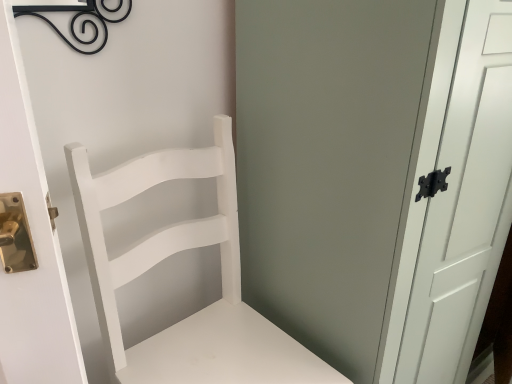
Question: From the image's perspective, is white matte screen door at center above or below white matte wood chair at center?

Choices:
 (A) below
 (B) above

Answer: (B)

Question: Is white matte screen door at center spatially inside white matte wood chair at center, or outside of it?

Choices:
 (A) inside
 (B) outside

Answer: (B)

Question: Considering the positions of white matte screen door at center and white matte wood chair at center in the image, is white matte screen door at center taller or shorter than white matte wood chair at center?

Choices:
 (A) short
 (B) tall

Answer: (B)

Question: Is white matte wood chair at center bigger or smaller than white matte screen door at center?

Choices:
 (A) big
 (B) small

Answer: (B)

Question: In terms of height, does white matte wood chair at center look taller or shorter compared to white matte screen door at center?

Choices:
 (A) short
 (B) tall

Answer: (A)

Question: Looking at their shapes, would you say white matte wood chair at center is wider or thinner than white matte screen door at center?

Choices:
 (A) wide
 (B) thin

Answer: (B)

Question: Visually, is white matte wood chair at center positioned to the left or to the right of white matte screen door at center?

Choices:
 (A) left
 (B) right

Answer: (A)